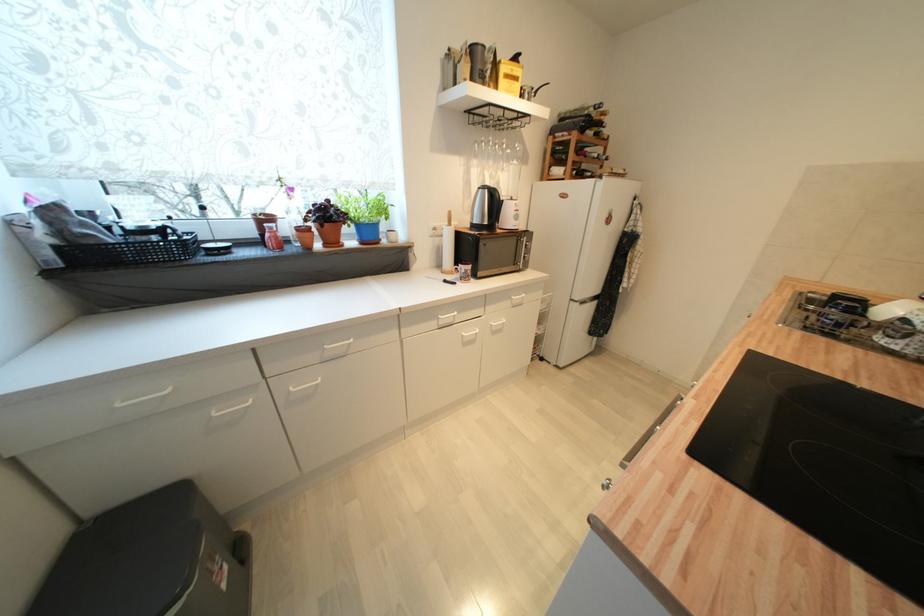
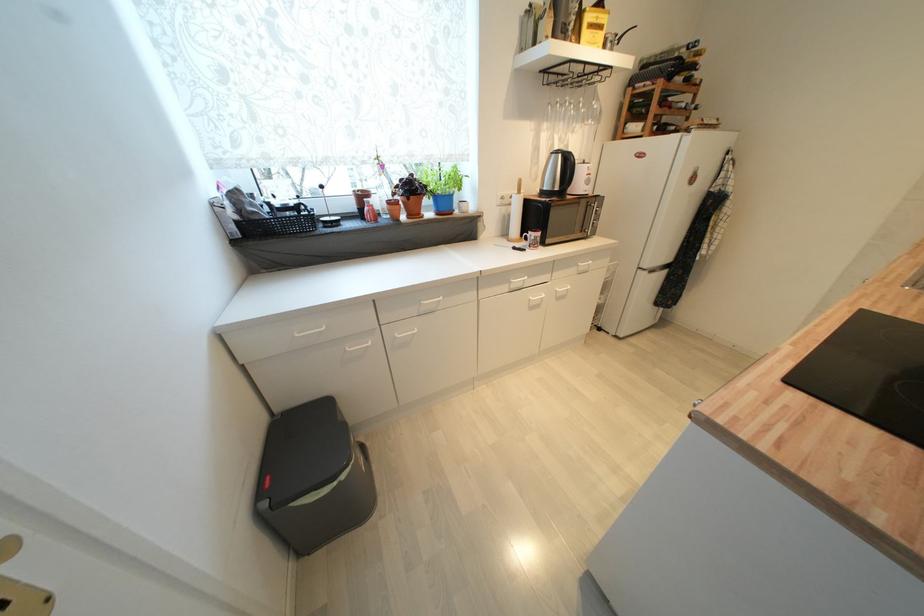
Where in the second image is the point corresponding to point (515, 74) from the first image?

(600, 23)